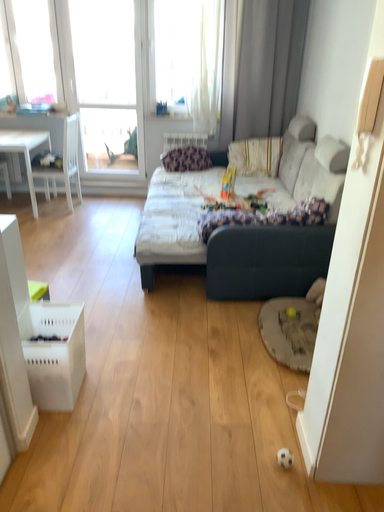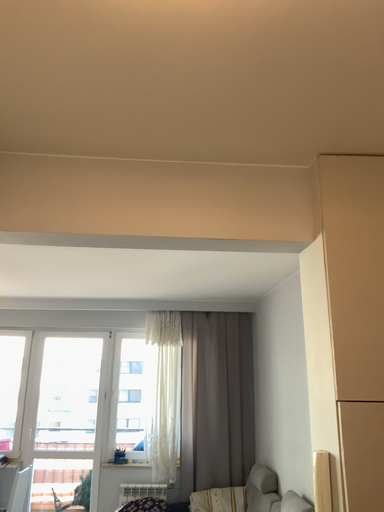
Question: Which way did the camera rotate in the video?

Choices:
 (A) rotated upward
 (B) rotated downward

Answer: (A)